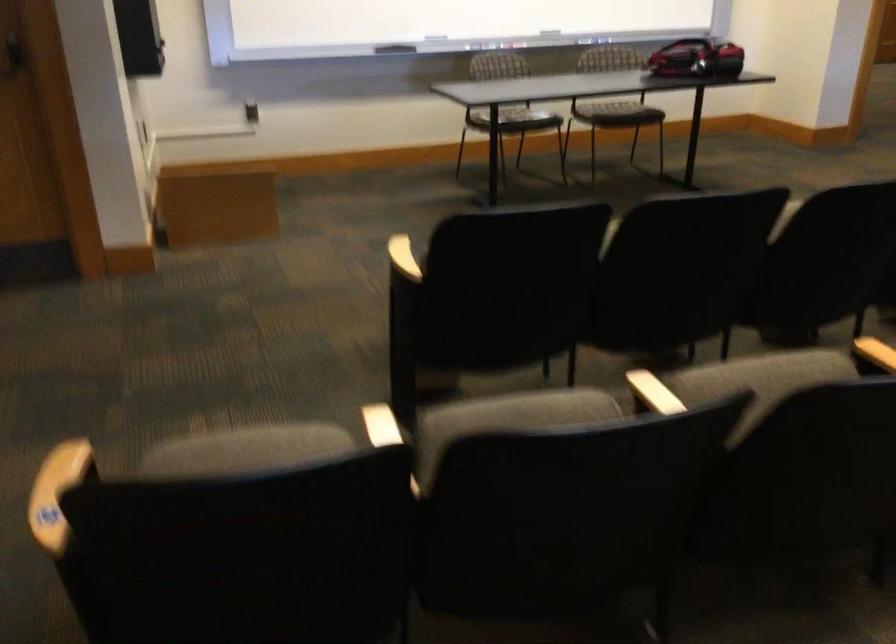
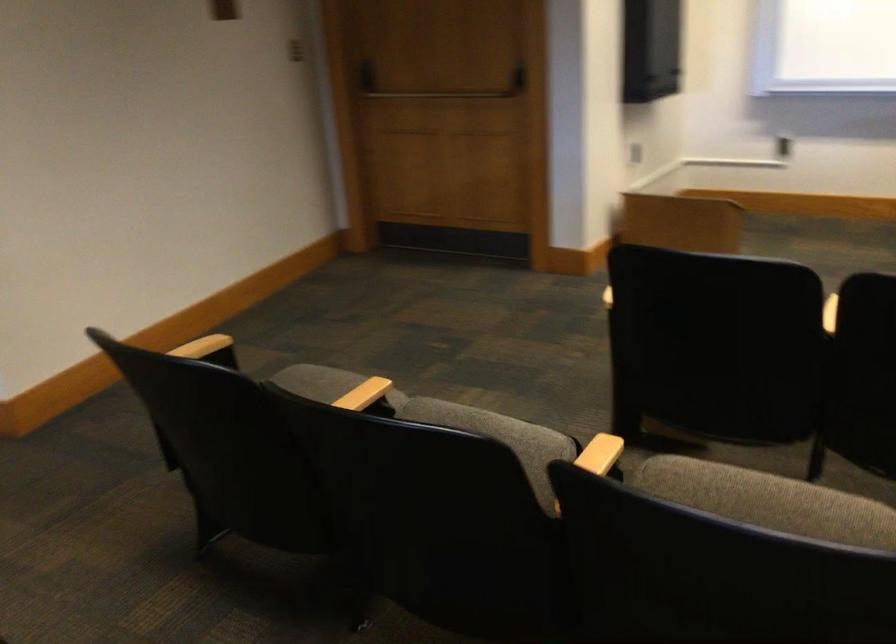
In the second image, find the point that corresponds to (x=181, y=451) in the first image.

(304, 370)